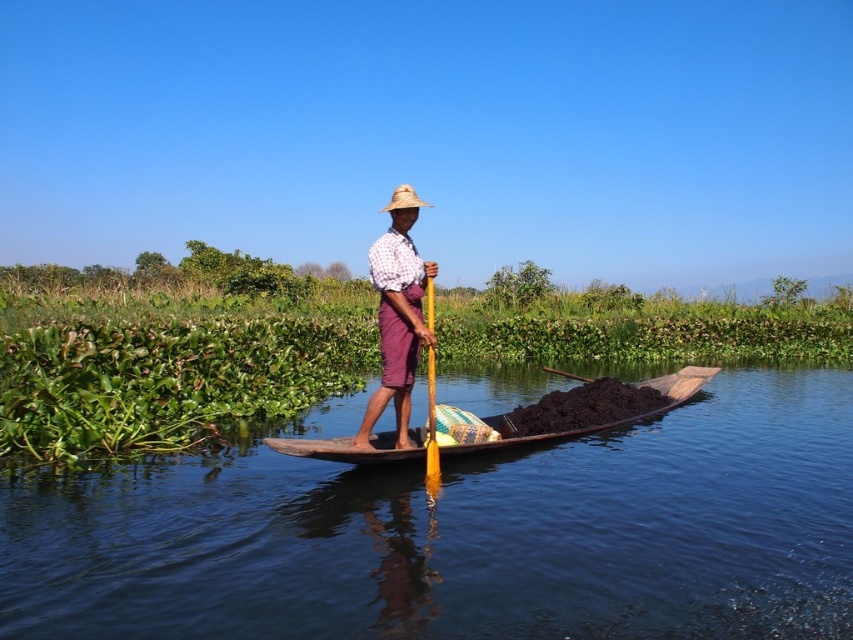
Question: Is brown wooden boat at center smaller than plaid fabric shirt at center?

Choices:
 (A) yes
 (B) no

Answer: (B)

Question: Among these points, which one is nearest to the camera?

Choices:
 (A) (432, 406)
 (B) (410, 189)

Answer: (B)

Question: Among these objects, which one is farthest from the camera?

Choices:
 (A) wooden canoe at center
 (B) plaid fabric shirt at center

Answer: (B)

Question: Among these objects, which one is nearest to the camera?

Choices:
 (A) wooden canoe at center
 (B) plaid fabric shirt at center
 (C) yellow wood paddle at center

Answer: (A)

Question: Is green leafy plants at center further to camera compared to straw hat at center?

Choices:
 (A) no
 (B) yes

Answer: (A)

Question: Does green leafy plants at center lie in front of straw hat at center?

Choices:
 (A) no
 (B) yes

Answer: (B)